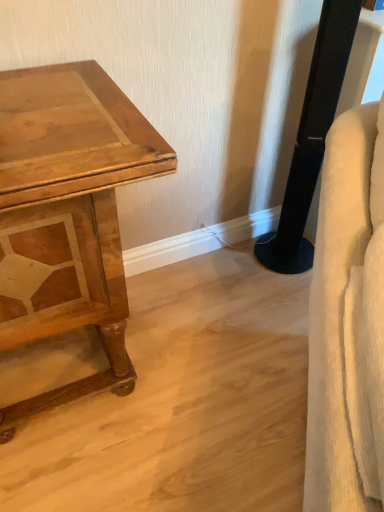
Where is `vacant space in front of black plastic speaker at right`? The width and height of the screenshot is (384, 512). vacant space in front of black plastic speaker at right is located at coordinates [274, 297].